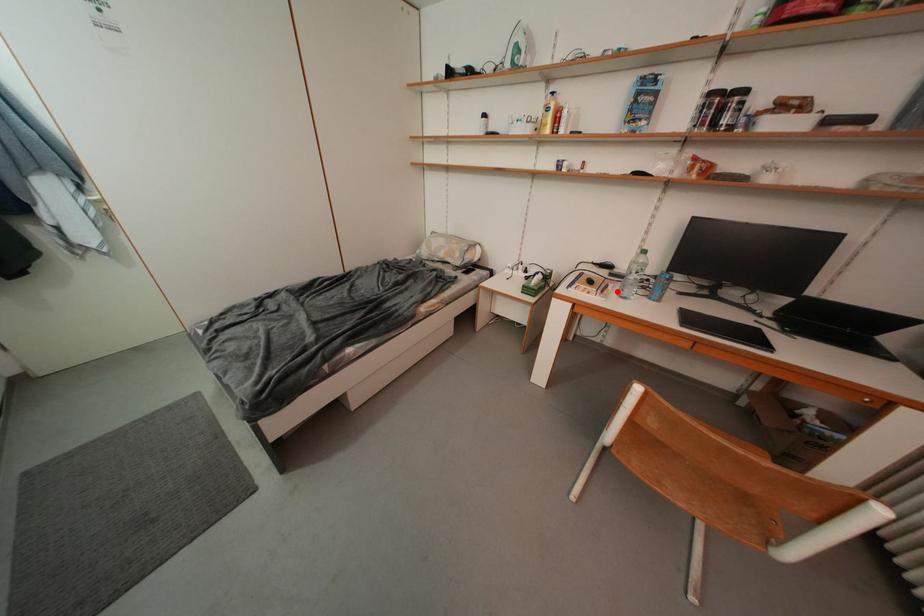
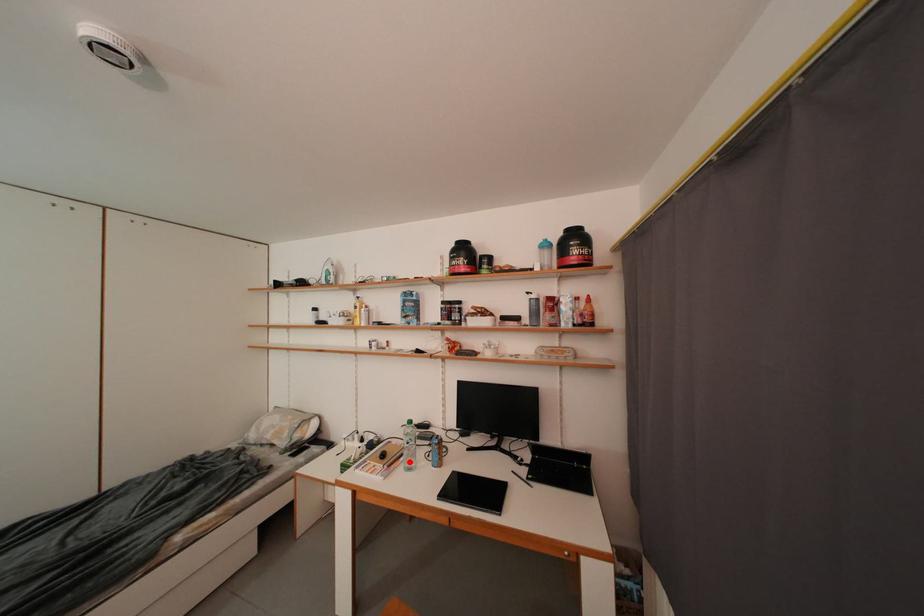
I am providing you with two images of the same scene from different viewpoints. A red point is marked on the first image and another point is marked on the second image. Are the points marked in image1 and image2 representing the same 3D position?

Yes